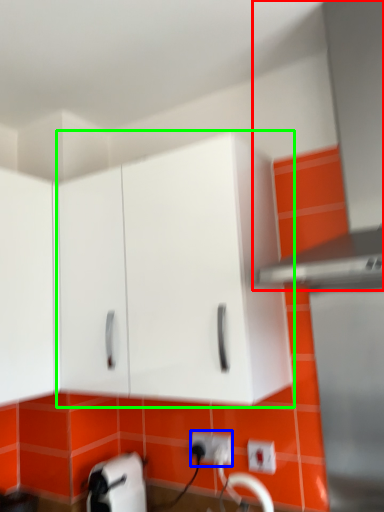
Question: Estimate the real-world distances between objects in this image. Which object is farther from exhaust hood (highlighted by a red box), electric outlet (highlighted by a blue box) or cabinetry (highlighted by a green box)?

Choices:
 (A) electric outlet
 (B) cabinetry

Answer: (A)